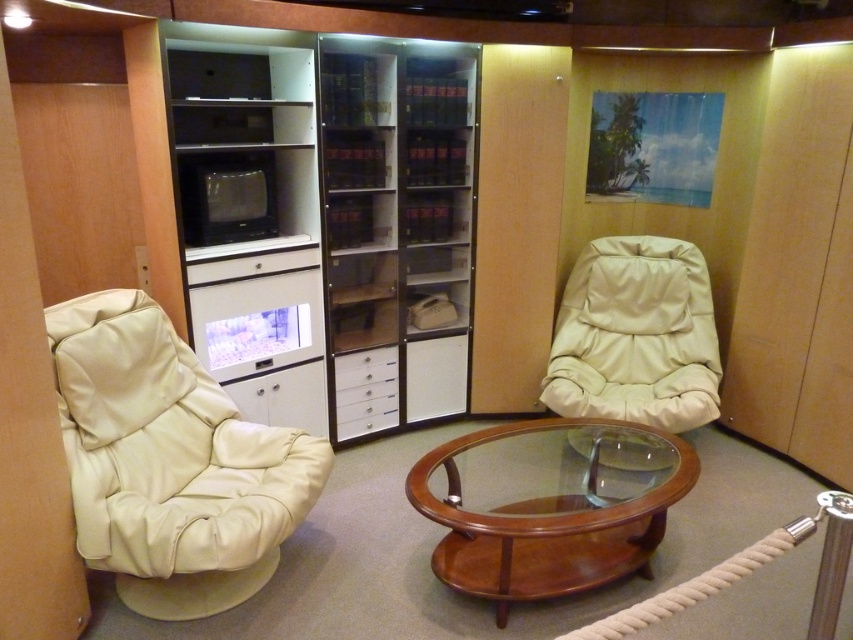
You are standing in the room and want to move from the point at coordinates (117, 320) to the point at (364, 404). Based on the spatial relationship between these two points, which direction should you move to reach your destination?

Since point (117, 320) is in front of point (364, 404), you should move backward to reach the destination.

You are a delivery person trying to place a large package on the floor between the white leather swivel chair at left and the white glossy drawer at center. Is there enough space for the package?

The white leather swivel chair at left is positioned under the white glossy drawer at center, meaning there is no floor space between them. The package cannot be placed there.